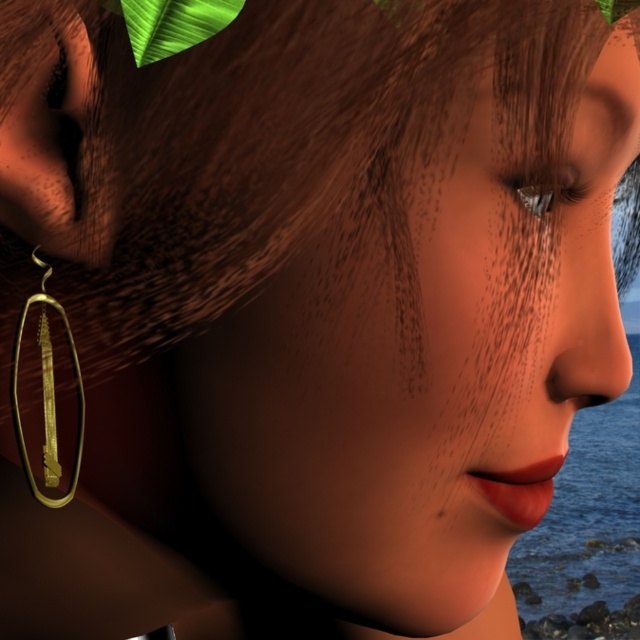
Question: Does blue water at right appear on the left side of gold/yellow metallic earring at left?

Choices:
 (A) yes
 (B) no

Answer: (B)

Question: Among these objects, which one is farthest from the camera?

Choices:
 (A) blue water at right
 (B) gold/yellow metallic earring at left

Answer: (A)

Question: Is the position of blue water at right more distant than that of gold/yellow metallic earring at left?

Choices:
 (A) yes
 (B) no

Answer: (A)

Question: Does blue water at right have a smaller size compared to gold/yellow metallic earring at left?

Choices:
 (A) yes
 (B) no

Answer: (B)